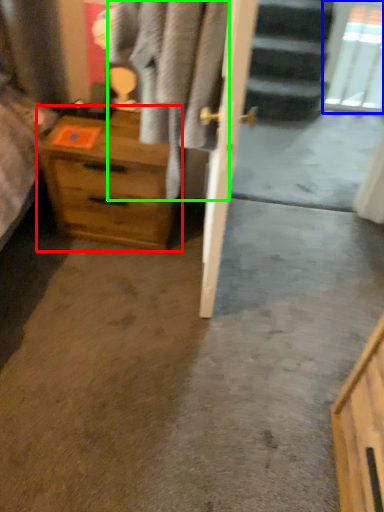
Question: Estimate the real-world distances between objects in this image. Which object is farther from chest of drawers (highlighted by a red box), glass door (highlighted by a blue box) or clothing (highlighted by a green box)?

Choices:
 (A) glass door
 (B) clothing

Answer: (A)